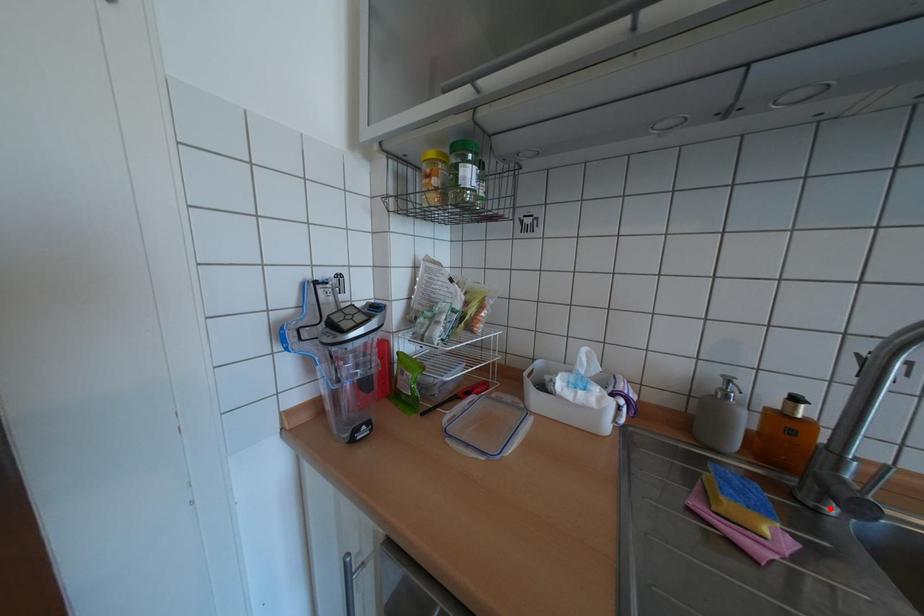
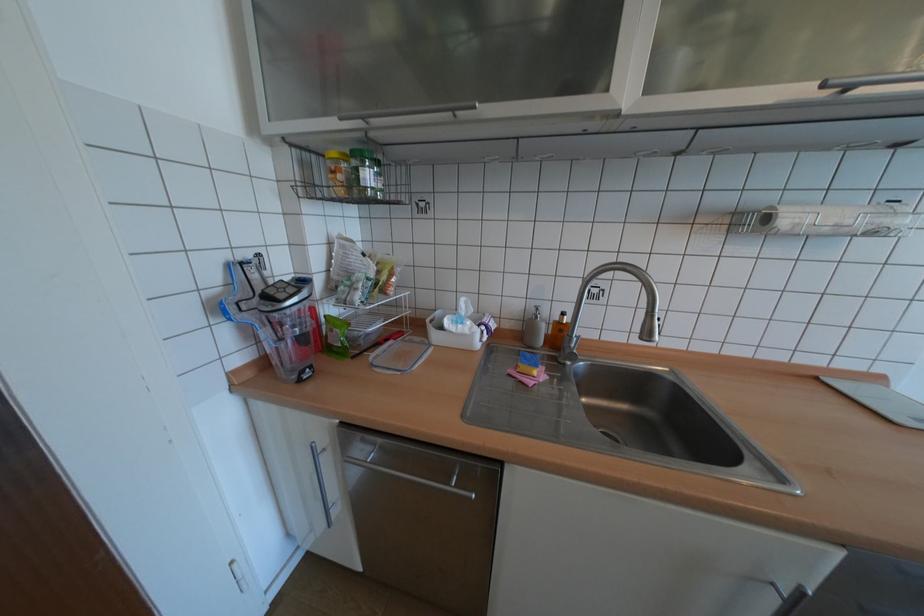
Question: A red point is marked in image1. In image2, is the corresponding 3D point closer to the camera or farther? Reply with the corresponding letter.

Choices:
 (A) The corresponding 3D point is closer.
 (B) The corresponding 3D point is farther.

Answer: (B)